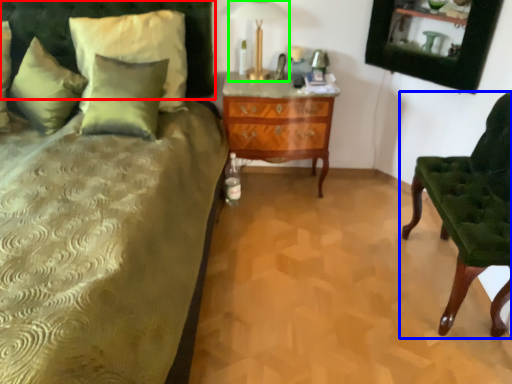
Question: Which object is positioned farthest from headboard (highlighted by a red box)? Select from chair (highlighted by a blue box) and table lamp (highlighted by a green box).

Choices:
 (A) chair
 (B) table lamp

Answer: (A)